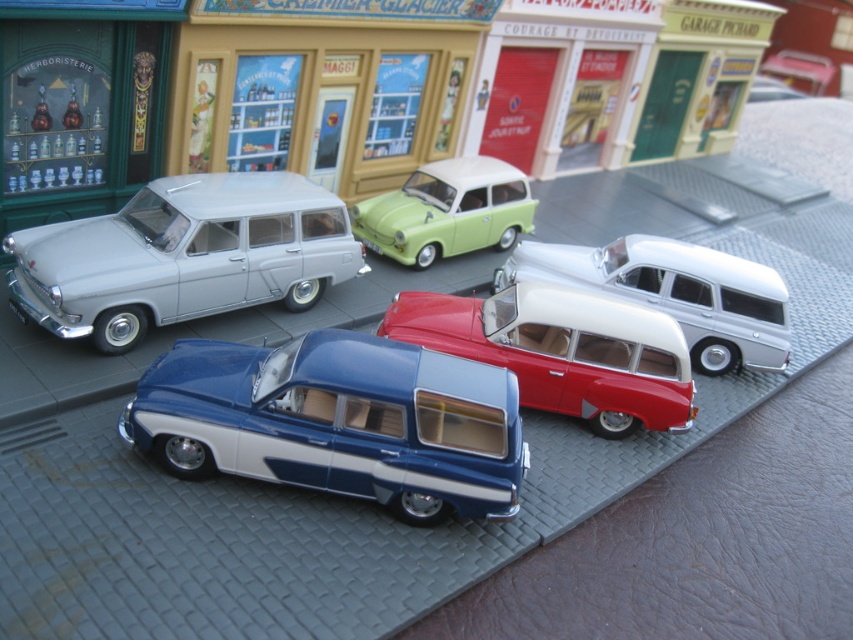
Question: Considering the relative positions of blue metallic station wagon at center and pastel green plastic car at center in the image provided, where is blue metallic station wagon at center located with respect to pastel green plastic car at center?

Choices:
 (A) below
 (B) above

Answer: (A)

Question: Which of these objects is positioned farthest from the pastel green plastic car at center?

Choices:
 (A) white glossy station wagon at center
 (B) matte white station wagon at center
 (C) blue metallic station wagon at center

Answer: (C)

Question: Which object appears closest to the camera in this image?

Choices:
 (A) matte silver station wagon at left
 (B) pastel green plastic car at center
 (C) white glossy station wagon at center
 (D) matte white station wagon at center

Answer: (A)

Question: Considering the relative positions of blue metallic station wagon at center and pastel green plastic car at center in the image provided, where is blue metallic station wagon at center located with respect to pastel green plastic car at center?

Choices:
 (A) right
 (B) left

Answer: (B)

Question: Is matte silver station wagon at left bigger than matte white station wagon at center?

Choices:
 (A) no
 (B) yes

Answer: (B)

Question: Which point is closer to the camera?

Choices:
 (A) matte silver station wagon at left
 (B) white glossy station wagon at center
 (C) blue metallic station wagon at center

Answer: (C)